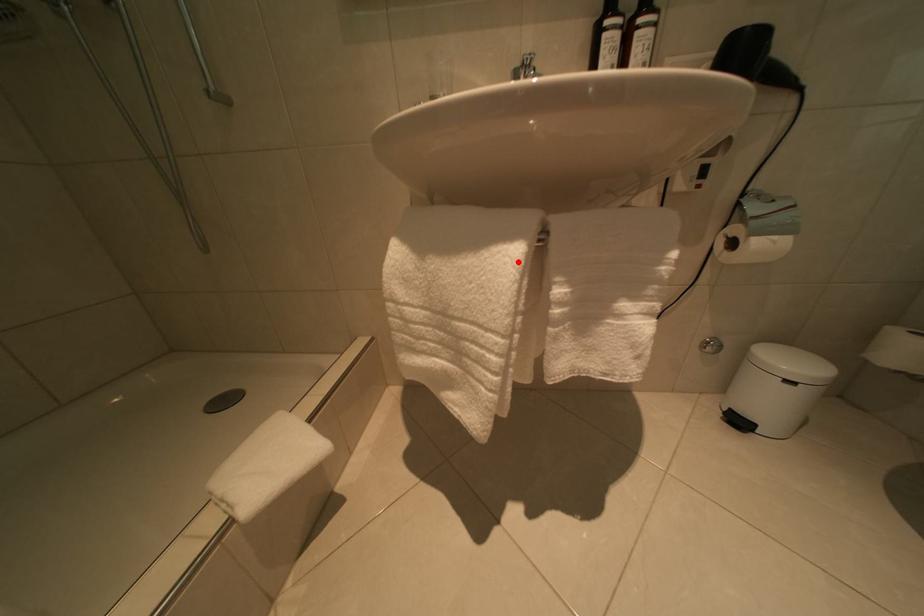
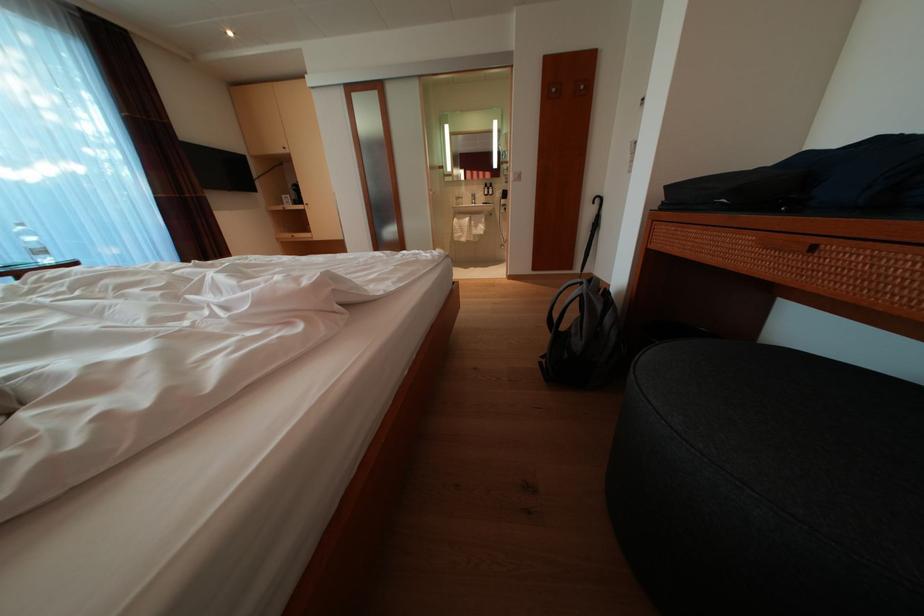
The point at the highlighted location is marked in the first image. Where is the corresponding point in the second image?

(476, 225)